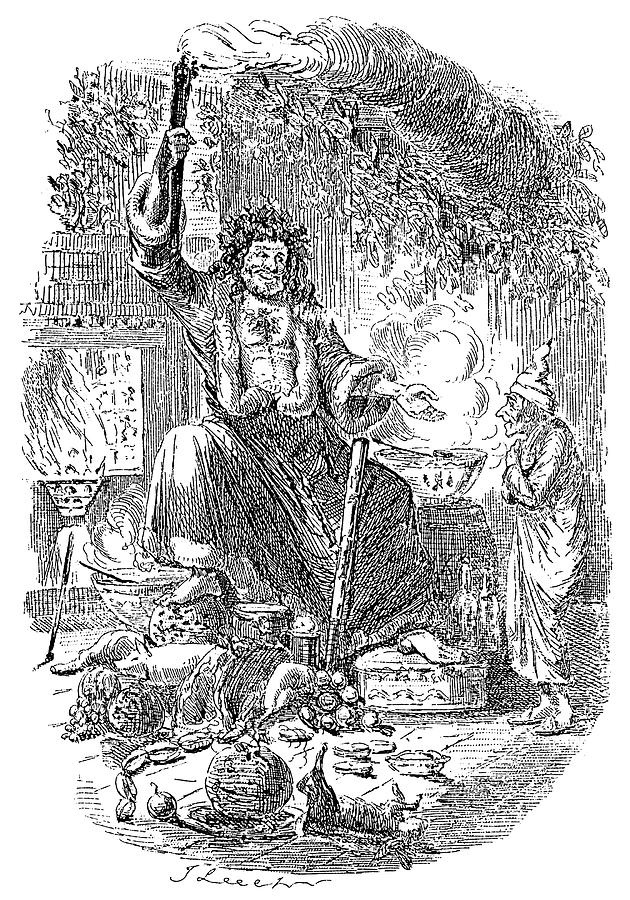
This screenshot has width=630, height=900. Find the location of `robe`. robe is located at coordinates (297, 405).